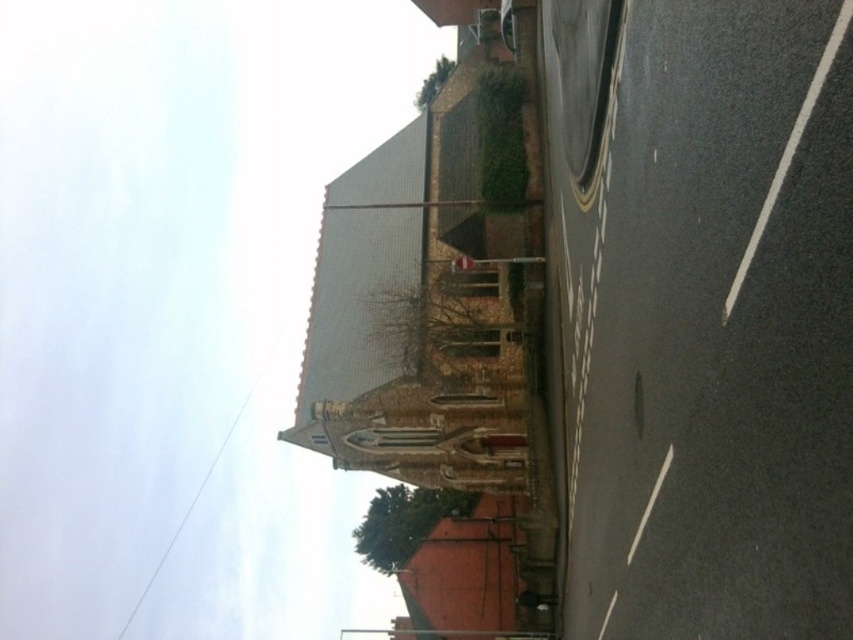
You are a delivery person trying to park your van near the church. You see the black asphalt at lower right and the brown brick fire escape at center. Which area has enough space for your van to park without blocking the fire escape?

The black asphalt at lower right has a width less than the brown brick fire escape at center, so the brown brick fire escape at center has more space and is suitable for parking the van without blocking it.

You are a delivery person needing to park your van near the church. You see the black asphalt at lower right and the brown brick fire escape at center. Which location is closer to the right side of the road?

The black asphalt at lower right is to the right of the brown brick fire escape at center, so it is closer to the right side of the road.

You are a delivery driver who needs to park your vehicle near the church. You see the black asphalt at lower right and the brown brick fire escape at center. Which area can accommodate a standard parking space?

The brown brick fire escape at center is larger than the black asphalt at lower right, so the brown brick fire escape at center can accommodate a standard parking space.